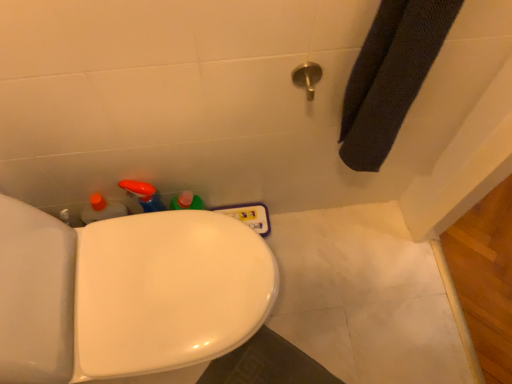
Question: From the image's perspective, is white glossy toilet at lower left positioned above or below metallic silver showerhead at upper center?

Choices:
 (A) above
 (B) below

Answer: (B)

Question: Relative to metallic silver showerhead at upper center, is white glossy toilet at lower left in front or behind?

Choices:
 (A) behind
 (B) front

Answer: (B)

Question: Considering the positions of point (184, 336) and point (303, 76), is point (184, 336) closer or farther from the camera than point (303, 76)?

Choices:
 (A) farther
 (B) closer

Answer: (A)

Question: Choose the correct answer: Is metallic silver showerhead at upper center inside white glossy toilet at lower left or outside it?

Choices:
 (A) outside
 (B) inside

Answer: (A)

Question: Relative to white glossy toilet at lower left, is metallic silver showerhead at upper center in front or behind?

Choices:
 (A) behind
 (B) front

Answer: (A)

Question: Considering the positions of metallic silver showerhead at upper center and white glossy toilet at lower left in the image, is metallic silver showerhead at upper center wider or thinner than white glossy toilet at lower left?

Choices:
 (A) wide
 (B) thin

Answer: (B)

Question: From a real-world perspective, relative to white glossy toilet at lower left, is metallic silver showerhead at upper center vertically above or below?

Choices:
 (A) above
 (B) below

Answer: (A)